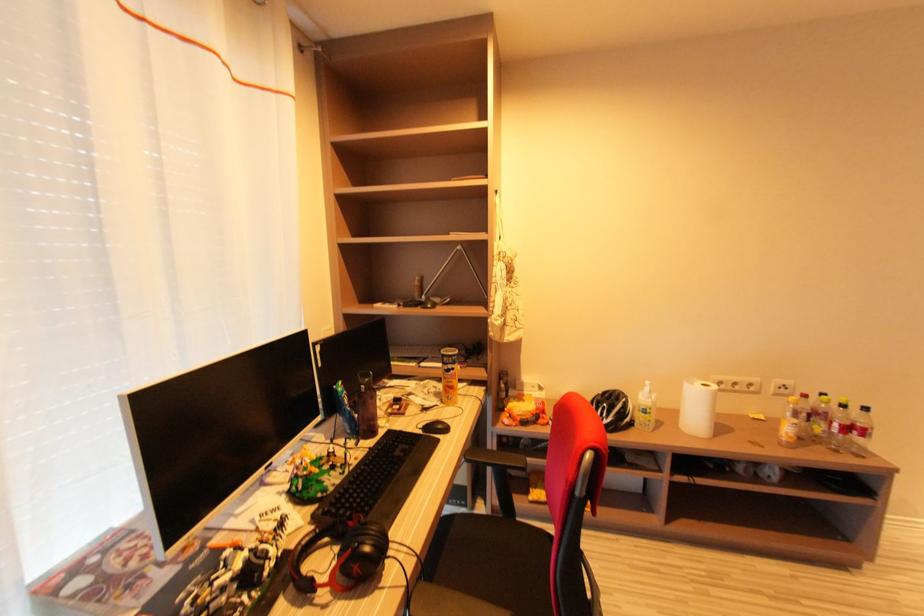
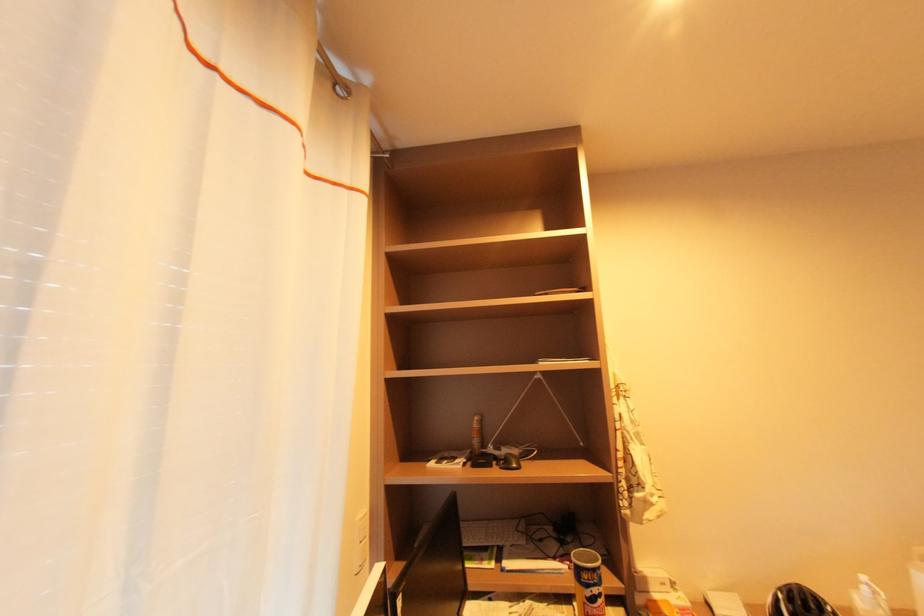
Question: How did the camera likely rotate?

Choices:
 (A) Left
 (B) Right
 (C) Up
 (D) Down

Answer: (C)